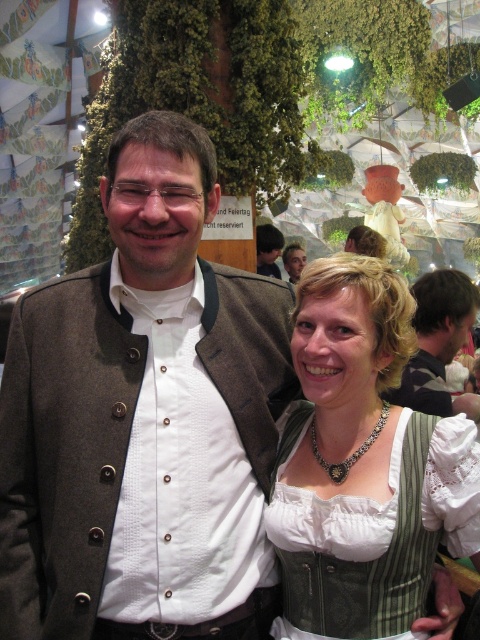
Question: Which of these objects is positioned farthest from the dark brown leather jacket at center?

Choices:
 (A) matte brown jacket at center
 (B) green plaid dirndl at center
 (C) brown wool jacket at center

Answer: (A)

Question: Is green plaid dirndl at center to the left of dark brown leather jacket at center from the viewer's perspective?

Choices:
 (A) no
 (B) yes

Answer: (B)

Question: Does green plaid dirndl at center have a greater width compared to matte brown jacket at center?

Choices:
 (A) no
 (B) yes

Answer: (B)

Question: Which of the following is the farthest from the observer?

Choices:
 (A) matte brown jacket at center
 (B) green plaid dirndl at center
 (C) brown wool jacket at center

Answer: (A)

Question: Which point is closer to the camera taking this photo?

Choices:
 (A) (283, 356)
 (B) (450, 396)

Answer: (A)

Question: Is green plaid dirndl at center wider than brown wool jacket at center?

Choices:
 (A) no
 (B) yes

Answer: (A)